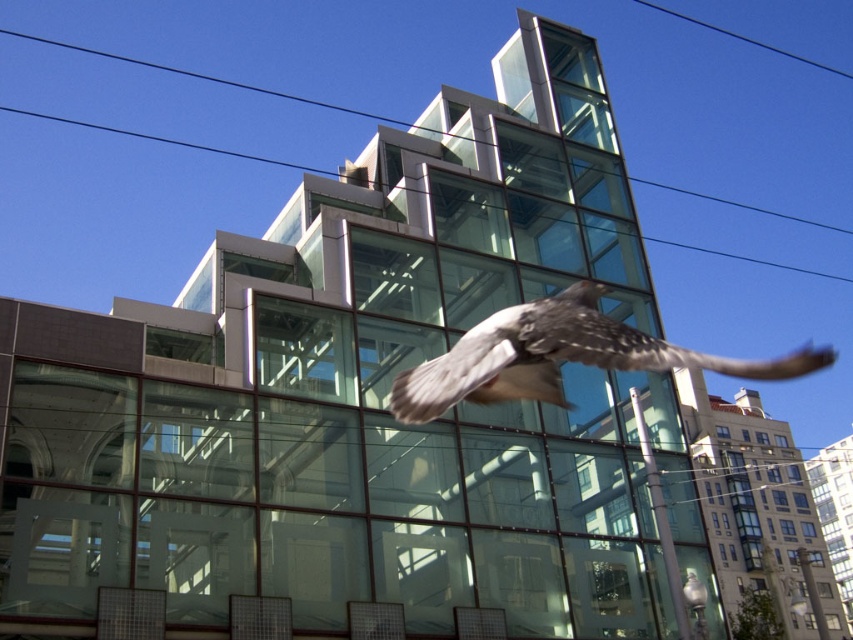
You are an architect standing at the base of the modern building and looking towards the sky. You notice two points marked in the scene. Which point is closer to you, point (419, 403) or point (280, 93)?

Point (419, 403) is in front of point (280, 93), so it is closer to you.

You are an architect designing a new building. You want to ensure that the speckled feathered bird at center and the transparent glass power line at upper center are visible from the main entrance. Based on their positions, which object will appear closer to the entrance when viewed from there?

The speckled feathered bird at center will appear closer to the entrance because it is positioned below the transparent glass power line at upper center, indicating it is lower in the visual hierarchy and thus closer to the observer.